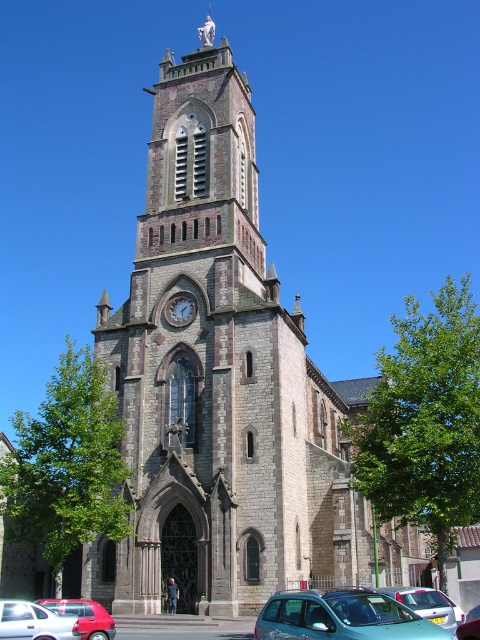
Does metallic silver car at center appear over metallic silver car at lower right?

Indeed, metallic silver car at center is positioned over metallic silver car at lower right.

Who is higher up, metallic silver car at center or metallic silver car at lower right?

metallic silver car at center is higher up.

Does point (394, 588) lie behind point (474, 637)?

That is True.

The image size is (480, 640). I want to click on metallic silver car at center, so click(x=428, y=604).

What do you see at coordinates (84, 616) in the screenshot? Image resolution: width=480 pixels, height=640 pixels. I see `matte red car at lower left` at bounding box center [84, 616].

Is matte red car at lower left closer to the viewer compared to matte gray clock at center?

Yes.

Which is behind, point (80, 609) or point (180, 321)?

Positioned behind is point (180, 321).

Locate an element on the screen. The width and height of the screenshot is (480, 640). matte red car at lower left is located at coordinates (84, 616).

Between brown stone church at center and matte gray clock at center, which one has less height?

matte gray clock at center

Does brown stone church at center lie in front of matte gray clock at center?

Yes.

Who is more distant from viewer, (132,380) or (179,320)?

The point (179,320) is more distant.

Image resolution: width=480 pixels, height=640 pixels. In order to click on brown stone church at center in this screenshot , I will do `click(225, 385)`.